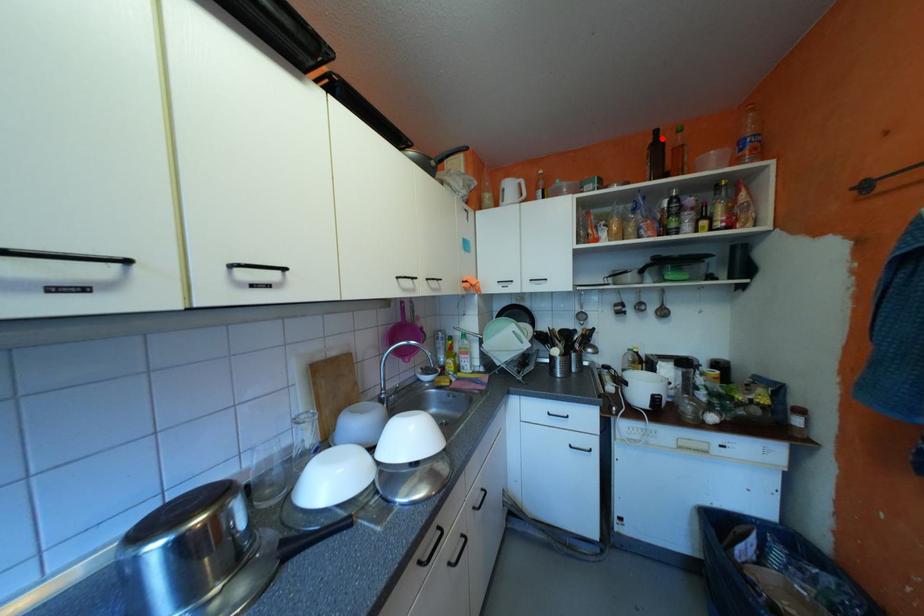
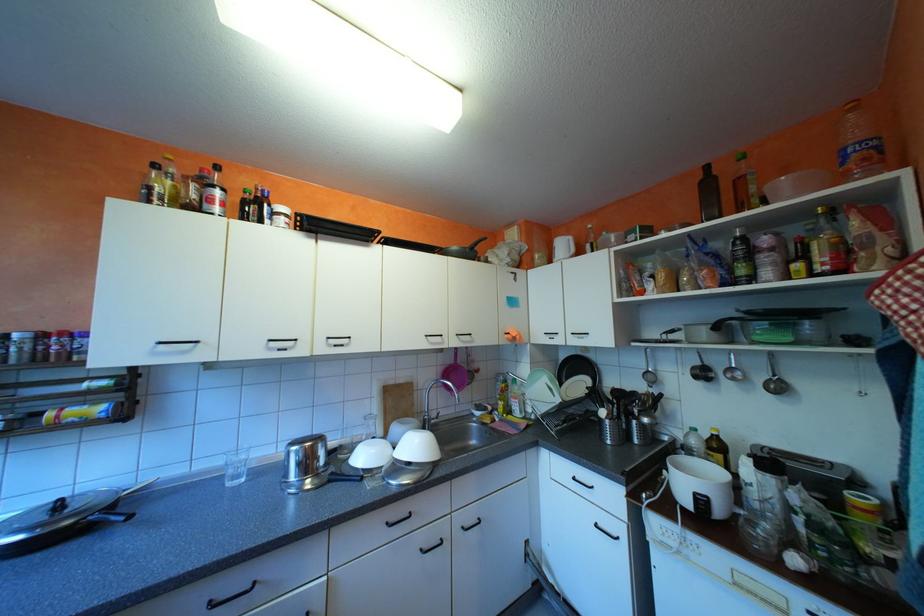
Locate, in the second image, the point that corresponds to the highlighted location in the first image.

(711, 176)